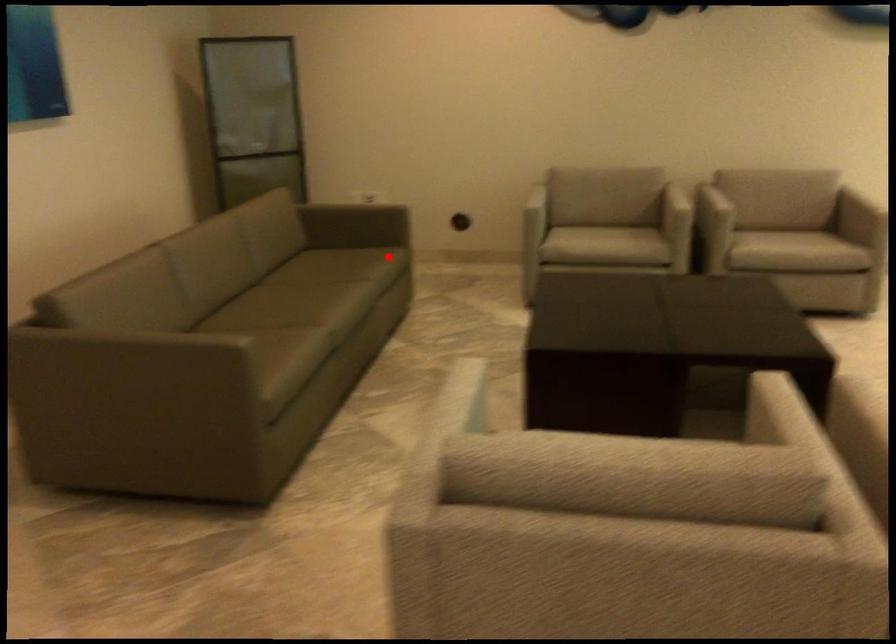
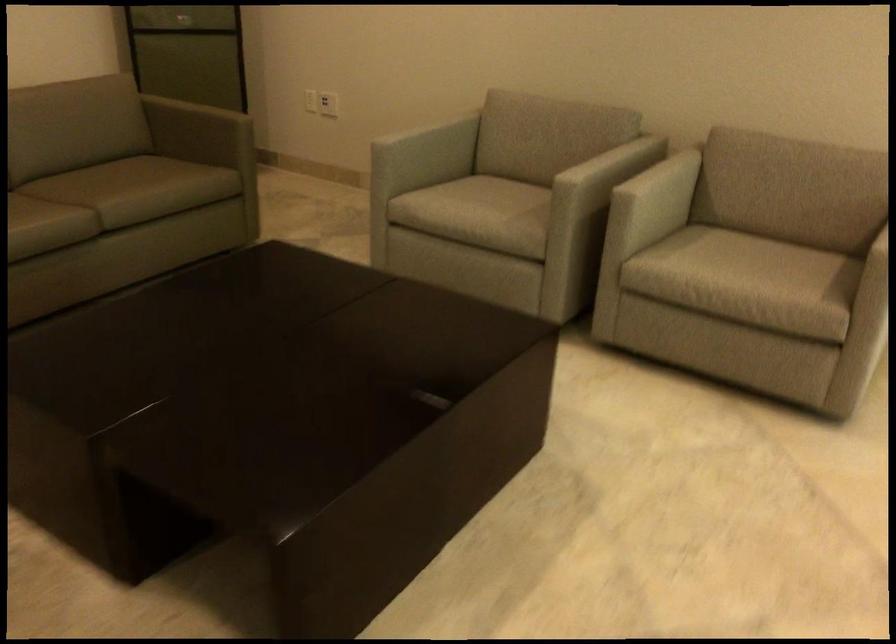
Question: I am providing you with two images of the same scene from different viewpoints. In image1, a red point is highlighted. Considering the same 3D point in image2, which of the following is correct?

Choices:
 (A) It is closer
 (B) It is farther

Answer: (A)